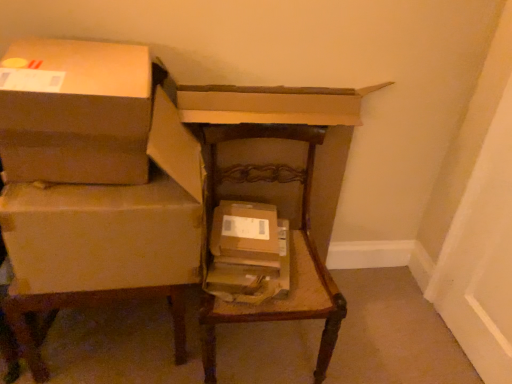
Question: Considering the positions of brown cardboard box at left, positioned as the second box in left-to-right order, and wooden chair at center, the first furniture when ordered from right to left, in the image, is brown cardboard box at left, positioned as the second box in left-to-right order, bigger or smaller than wooden chair at center, the first furniture when ordered from right to left,?

Choices:
 (A) small
 (B) big

Answer: (A)

Question: From a real-world perspective, is brown cardboard box at left, positioned as the second box in left-to-right order, positioned above or below wooden chair at center, placed as the second furniture when sorted from left to right?

Choices:
 (A) above
 (B) below

Answer: (A)

Question: Considering the real-world distances, which object is farthest from the brown cardboard box at left, positioned as the second box in left-to-right order?

Choices:
 (A) brown cardboard box at upper left, arranged as the third box when viewed from the right
 (B) brown cardboard boxes at left, placed as the 1th furniture when sorted from left to right
 (C) wooden chair at center, placed as the second furniture when sorted from left to right
 (D) brown cardboard box at center, which appears as the third box when viewed from the left

Answer: (C)

Question: Which is farther from the brown cardboard box at left, positioned as the second box in right-to-left order?

Choices:
 (A) brown cardboard box at center, which ranks as the 1th box in right-to-left order
 (B) brown cardboard boxes at left, placed as the 2th furniture when sorted from right to left
 (C) brown cardboard box at upper left, which is the 1th box in left-to-right order
 (D) wooden chair at center, placed as the second furniture when sorted from left to right

Answer: (D)